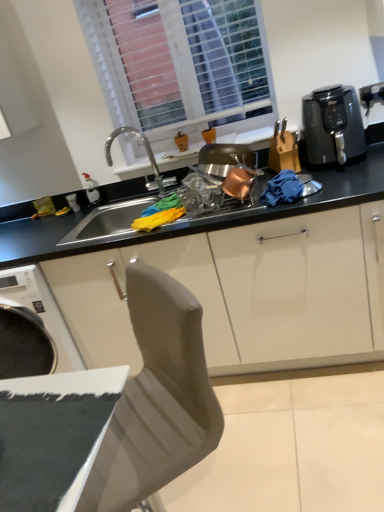
Question: Is black matte countertop at center to the left of white plastic window at upper center from the viewer's perspective?

Choices:
 (A) yes
 (B) no

Answer: (A)

Question: Are black matte countertop at center and white plastic window at upper center far apart?

Choices:
 (A) no
 (B) yes

Answer: (A)

Question: Is white plastic window at upper center at the back of black matte countertop at center?

Choices:
 (A) no
 (B) yes

Answer: (A)

Question: Is black matte countertop at center taller than white plastic window at upper center?

Choices:
 (A) no
 (B) yes

Answer: (A)

Question: Considering the relative sizes of black matte countertop at center and white plastic window at upper center in the image provided, is black matte countertop at center bigger than white plastic window at upper center?

Choices:
 (A) no
 (B) yes

Answer: (A)

Question: Considering the positions of white plastic window at upper center and black matte countertop at center in the image, is white plastic window at upper center taller or shorter than black matte countertop at center?

Choices:
 (A) short
 (B) tall

Answer: (B)

Question: From a real-world perspective, is white plastic window at upper center above or below black matte countertop at center?

Choices:
 (A) above
 (B) below

Answer: (A)

Question: Does point (139, 52) appear closer or farther from the camera than point (324, 193)?

Choices:
 (A) farther
 (B) closer

Answer: (A)

Question: Is white plastic window at upper center inside or outside of black matte countertop at center?

Choices:
 (A) outside
 (B) inside

Answer: (A)

Question: In the image, is black plastic air fryer at upper right on the left side or the right side of white plastic window at upper center?

Choices:
 (A) left
 (B) right

Answer: (B)

Question: Considering the positions of black plastic air fryer at upper right and white plastic window at upper center in the image, is black plastic air fryer at upper right bigger or smaller than white plastic window at upper center?

Choices:
 (A) big
 (B) small

Answer: (B)

Question: In terms of width, does black plastic air fryer at upper right look wider or thinner when compared to white plastic window at upper center?

Choices:
 (A) wide
 (B) thin

Answer: (A)

Question: From the image's perspective, relative to white plastic window at upper center, is black plastic air fryer at upper right above or below?

Choices:
 (A) below
 (B) above

Answer: (A)

Question: Is black plastic knife block at right in front of or behind white plastic window at upper center in the image?

Choices:
 (A) front
 (B) behind

Answer: (A)

Question: In terms of width, does black plastic knife block at right look wider or thinner when compared to white plastic window at upper center?

Choices:
 (A) wide
 (B) thin

Answer: (A)